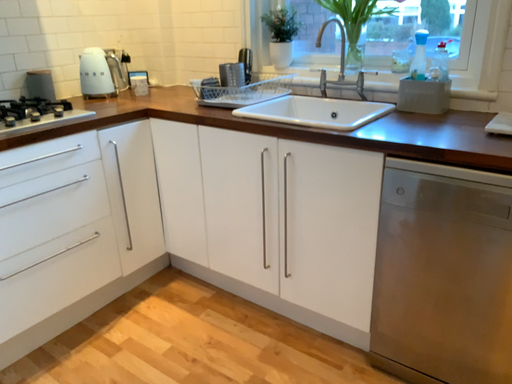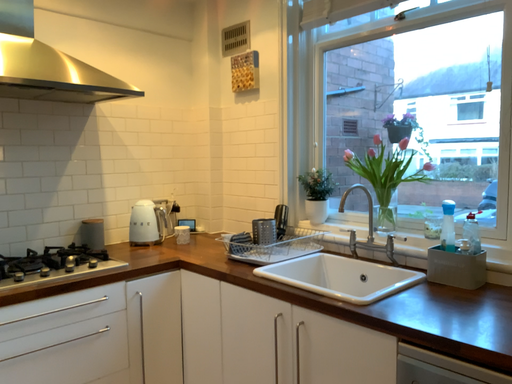
Question: Which way did the camera rotate in the video?

Choices:
 (A) rotated left
 (B) rotated right

Answer: (A)